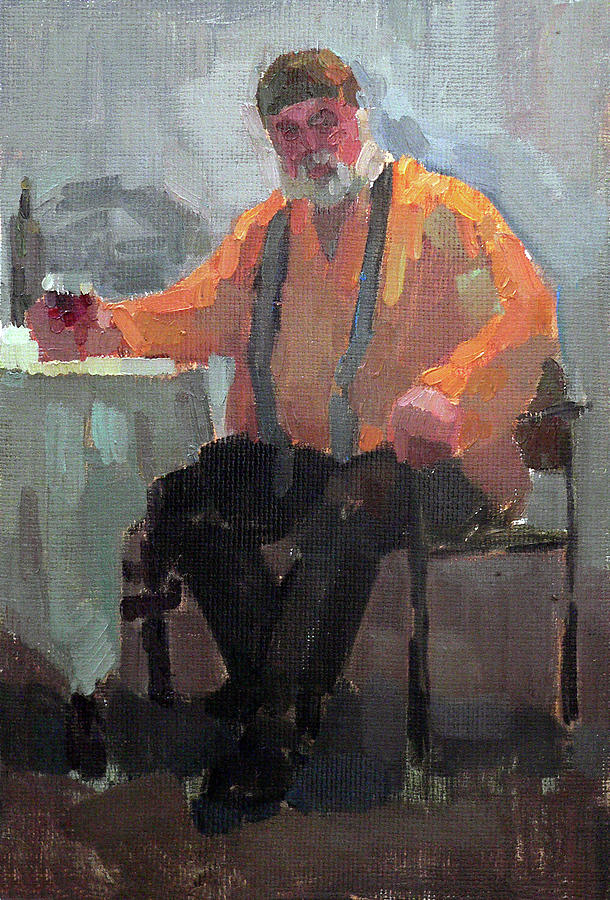
Locate an element on the screen. The width and height of the screenshot is (610, 900). glass of wine is located at coordinates (73, 300).